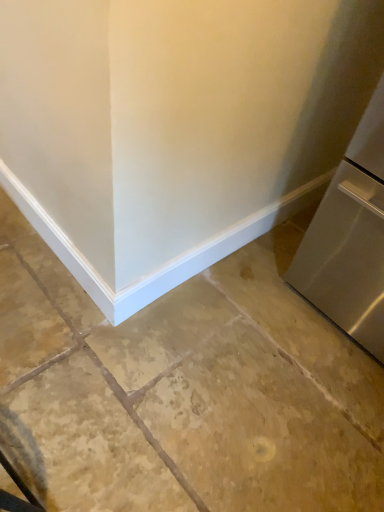
What do you see at coordinates (189, 388) in the screenshot?
I see `brown stone floor at center` at bounding box center [189, 388].

Where is `brown stone floor at center`? This screenshot has height=512, width=384. brown stone floor at center is located at coordinates (189, 388).

This screenshot has height=512, width=384. Identify the location of satin silver refrigerator at right. (350, 238).

The image size is (384, 512). What do you see at coordinates (350, 238) in the screenshot? I see `satin silver refrigerator at right` at bounding box center [350, 238].

Find the location of a particular element. Image resolution: width=384 pixels, height=512 pixels. brown stone floor at center is located at coordinates (189, 388).

Looking at this image, between brown stone floor at center and satin silver refrigerator at right, which one appears on the left side from the viewer's perspective?

brown stone floor at center is more to the left.

Relative to satin silver refrigerator at right, is brown stone floor at center in front or behind?

brown stone floor at center is positioned farther from the viewer than satin silver refrigerator at right.

Which is in front, point (195, 281) or point (376, 97)?

The point (376, 97) is closer.

From the image's perspective, does brown stone floor at center appear higher than satin silver refrigerator at right?

No.

In the scene shown: From a real-world perspective, which object rests below the other?

In real-world perspective, brown stone floor at center is lower.

Looking at this image, in terms of width, does brown stone floor at center look wider or thinner when compared to satin silver refrigerator at right?

brown stone floor at center is wider than satin silver refrigerator at right.

Looking at this image, considering the relative sizes of brown stone floor at center and satin silver refrigerator at right in the image provided, is brown stone floor at center taller than satin silver refrigerator at right?

Incorrect, the height of brown stone floor at center is not larger of that of satin silver refrigerator at right.

Considering the relative sizes of brown stone floor at center and satin silver refrigerator at right in the image provided, is brown stone floor at center smaller than satin silver refrigerator at right?

Indeed, brown stone floor at center has a smaller size compared to satin silver refrigerator at right.

Would you say brown stone floor at center is inside or outside satin silver refrigerator at right?

brown stone floor at center is outside satin silver refrigerator at right.

Consider the image. Is brown stone floor at center with satin silver refrigerator at right?

No, brown stone floor at center is not making contact with satin silver refrigerator at right.

Is brown stone floor at center facing away from satin silver refrigerator at right?

No, brown stone floor at center's orientation is not away from satin silver refrigerator at right.

In the scene shown: How many degrees apart are the facing directions of brown stone floor at center and satin silver refrigerator at right?

They differ by 89.1 degrees in their facing directions.

Image resolution: width=384 pixels, height=512 pixels. In order to click on refrigerator that is above the brown stone floor at center (from the image's perspective) in this screenshot , I will do `click(350, 238)`.

Is satin silver refrigerator at right to the left of brown stone floor at center from the viewer's perspective?

In fact, satin silver refrigerator at right is to the right of brown stone floor at center.

Does satin silver refrigerator at right come behind brown stone floor at center?

No, it is not.

Considering the positions of points (293, 262) and (377, 416), is point (293, 262) closer to camera compared to point (377, 416)?

No, (293, 262) is further to viewer.

From the image's perspective, does satin silver refrigerator at right appear lower than brown stone floor at center?

No, from the image's perspective, satin silver refrigerator at right is not below brown stone floor at center.

From a real-world perspective, is satin silver refrigerator at right below brown stone floor at center?

No, from a real-world perspective, satin silver refrigerator at right is not below brown stone floor at center.

Is satin silver refrigerator at right thinner than brown stone floor at center?

Yes.

From their relative heights in the image, would you say satin silver refrigerator at right is taller or shorter than brown stone floor at center?

satin silver refrigerator at right is taller than brown stone floor at center.

Is satin silver refrigerator at right smaller than brown stone floor at center?

Actually, satin silver refrigerator at right might be larger than brown stone floor at center.

Is brown stone floor at center located within satin silver refrigerator at right?

No, brown stone floor at center is located outside of satin silver refrigerator at right.

Based on the photo, is satin silver refrigerator at right far from brown stone floor at center?

satin silver refrigerator at right is actually quite close to brown stone floor at center.

Is satin silver refrigerator at right turned away from brown stone floor at center?

No, satin silver refrigerator at right is not facing away from brown stone floor at center.

Looking at this image, can you tell me how much satin silver refrigerator at right and brown stone floor at center differ in facing direction?

The angular difference between satin silver refrigerator at right and brown stone floor at center is 89.1 degrees.

The height and width of the screenshot is (512, 384). Find the location of `concrete behind the satin silver refrigerator at right`. concrete behind the satin silver refrigerator at right is located at coordinates (189, 388).

Locate an element on the screen. concrete below the satin silver refrigerator at right (from a real-world perspective) is located at coordinates (189, 388).

The width and height of the screenshot is (384, 512). Find the location of `refrigerator above the brown stone floor at center (from a real-world perspective)`. refrigerator above the brown stone floor at center (from a real-world perspective) is located at coordinates (350, 238).